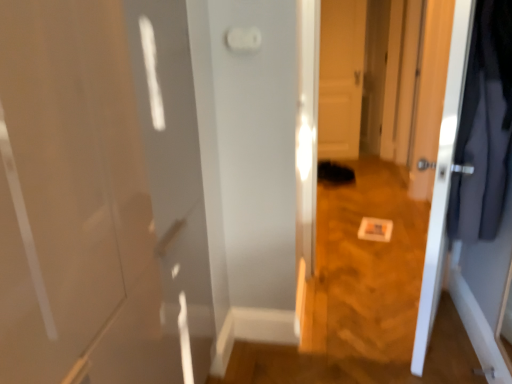
What is the approximate height of white glossy door at center, acting as the first door starting from the back?

It is 1.61 meters.

Describe the element at coordinates (243, 39) in the screenshot. I see `white plastic light switch at upper center` at that location.

Describe the element at coordinates (484, 126) in the screenshot. Image resolution: width=512 pixels, height=384 pixels. I see `dark gray fabric coat at right` at that location.

How much space does white glossy door at right, which appears as the 1th door when viewed from the front, occupy vertically?

The height of white glossy door at right, which appears as the 1th door when viewed from the front, is 4.84 feet.

At what (x,y) coordinates should I click in order to perform the action: click on white glossy door at right, which appears as the 1th door when viewed from the front. Please return your answer as a coordinate pair (x, y). Looking at the image, I should click on (474, 187).

This screenshot has height=384, width=512. I want to click on white glossy door at center, acting as the first door starting from the back, so click(x=340, y=78).

Does dark gray fabric coat at right come behind white glossy door at right, which appears as the 1th door when viewed from the front?

No, it is in front of white glossy door at right, which appears as the 1th door when viewed from the front.

From a real-world perspective, is dark gray fabric coat at right on top of white glossy door at right, which is the second door in back-to-front order?

Indeed, from a real-world perspective, dark gray fabric coat at right stands above white glossy door at right, which is the second door in back-to-front order.

Which object is positioned more to the left, dark gray fabric coat at right or white glossy door at right, which appears as the 1th door when viewed from the front?

white glossy door at right, which appears as the 1th door when viewed from the front.

Based on the photo, based on their sizes in the image, would you say dark gray fabric coat at right is bigger or smaller than white glossy door at right, which appears as the 1th door when viewed from the front?

Considering their sizes, dark gray fabric coat at right takes up less space than white glossy door at right, which appears as the 1th door when viewed from the front.

Considering the positions of points (345, 88) and (496, 312), is point (345, 88) farther from camera compared to point (496, 312)?

Yes, it is.

How many degrees apart are the facing directions of white glossy door at center, acting as the first door starting from the back, and white glossy door at right, which is the second door in back-to-front order?

124 degrees.

Would you say white glossy door at center, which appears as the 2th door when viewed from the front, is to the left or to the right of white glossy door at right, which is the second door in back-to-front order, in the picture?

Clearly, white glossy door at center, which appears as the 2th door when viewed from the front, is on the right of white glossy door at right, which is the second door in back-to-front order, in the image.

How distant is white glossy door at center, acting as the first door starting from the back, from white glossy door at right, which appears as the 1th door when viewed from the front?

white glossy door at center, acting as the first door starting from the back, and white glossy door at right, which appears as the 1th door when viewed from the front, are 2.76 meters apart from each other.

Considering the points (258, 33) and (484, 32), which point is behind, point (258, 33) or point (484, 32)?

The point (258, 33) is behind.

Visually, is white plastic light switch at upper center positioned to the left or to the right of white glossy door at right, which appears as the 1th door when viewed from the front?

Based on their positions, white plastic light switch at upper center is located to the left of white glossy door at right, which appears as the 1th door when viewed from the front.

Can you confirm if white plastic light switch at upper center is thinner than white glossy door at right, which is the second door in back-to-front order?

Yes, white plastic light switch at upper center is thinner than white glossy door at right, which is the second door in back-to-front order.

Is white plastic light switch at upper center not within white glossy door at right, which is the second door in back-to-front order?

Absolutely, white plastic light switch at upper center is external to white glossy door at right, which is the second door in back-to-front order.

Does white plastic light switch at upper center have a lesser height compared to dark gray fabric coat at right?

Yes, white plastic light switch at upper center is shorter than dark gray fabric coat at right.

In the scene shown: Does white plastic light switch at upper center have a lesser width compared to dark gray fabric coat at right?

Yes.

Is white plastic light switch at upper center not close to dark gray fabric coat at right?

white plastic light switch at upper center is actually quite close to dark gray fabric coat at right.

Does white glossy door at center, acting as the first door starting from the back, lie behind white plastic light switch at upper center?

Yes.

Is white glossy door at center, which appears as the 2th door when viewed from the front, outside of white plastic light switch at upper center?

Absolutely, white glossy door at center, which appears as the 2th door when viewed from the front, is external to white plastic light switch at upper center.

From the image's perspective, would you say white glossy door at center, which appears as the 2th door when viewed from the front, is positioned over white plastic light switch at upper center?

Yes, from the image's perspective, white glossy door at center, which appears as the 2th door when viewed from the front, is on top of white plastic light switch at upper center.

Are white glossy door at center, acting as the first door starting from the back, and white plastic light switch at upper center located far from each other?

Yes, white glossy door at center, acting as the first door starting from the back, is far from white plastic light switch at upper center.

From the image's perspective, which is above, dark gray fabric coat at right or white plastic light switch at upper center?

white plastic light switch at upper center.

Which object is positioned more to the left, dark gray fabric coat at right or white plastic light switch at upper center?

white plastic light switch at upper center is more to the left.

Is the depth of dark gray fabric coat at right less than that of white plastic light switch at upper center?

Yes, dark gray fabric coat at right is closer to the camera.

Is white plastic light switch at upper center directly adjacent to white glossy door at center, which appears as the 2th door when viewed from the front?

No, white plastic light switch at upper center is not next to white glossy door at center, which appears as the 2th door when viewed from the front.

Considering the relative sizes of white plastic light switch at upper center and white glossy door at center, acting as the first door starting from the back, in the image provided, is white plastic light switch at upper center taller than white glossy door at center, acting as the first door starting from the back,?

No.

Locate an element on the screen. The height and width of the screenshot is (384, 512). light switch located in front of the white glossy door at center, acting as the first door starting from the back is located at coordinates (243, 39).

This screenshot has height=384, width=512. I want to click on the 2nd door positioned below the dark gray fabric coat at right (from a real-world perspective), so click(474, 187).

The height and width of the screenshot is (384, 512). Find the location of `door above the white glossy door at right, which appears as the 1th door when viewed from the front (from the image's perspective)`. door above the white glossy door at right, which appears as the 1th door when viewed from the front (from the image's perspective) is located at coordinates (340, 78).

Based on their spatial positions, is dark gray fabric coat at right or white glossy door at right, which is the second door in back-to-front order, further from white plastic light switch at upper center?

white glossy door at right, which is the second door in back-to-front order, lies further to white plastic light switch at upper center than the other object.

Based on their spatial positions, is dark gray fabric coat at right or white glossy door at center, acting as the first door starting from the back, closer to white plastic light switch at upper center?

The object closer to white plastic light switch at upper center is dark gray fabric coat at right.

From the image, which object appears to be farther from white glossy door at right, which appears as the 1th door when viewed from the front, dark gray fabric coat at right or white plastic light switch at upper center?

white plastic light switch at upper center.

When comparing their distances from white glossy door at center, which appears as the 2th door when viewed from the front, does dark gray fabric coat at right or white glossy door at right, which is the second door in back-to-front order, seem closer?

Among the two, white glossy door at right, which is the second door in back-to-front order, is located nearer to white glossy door at center, which appears as the 2th door when viewed from the front.

Estimate the real-world distances between objects in this image. Which object is further from white plastic light switch at upper center, white glossy door at right, which appears as the 1th door when viewed from the front, or white glossy door at center, which appears as the 2th door when viewed from the front?

white glossy door at center, which appears as the 2th door when viewed from the front, is positioned further to the anchor white plastic light switch at upper center.

When comparing their distances from white glossy door at center, which appears as the 2th door when viewed from the front, does white glossy door at right, which is the second door in back-to-front order, or dark gray fabric coat at right seem further?

dark gray fabric coat at right is further to white glossy door at center, which appears as the 2th door when viewed from the front.

Looking at the image, which one is located further to dark gray fabric coat at right, white plastic light switch at upper center or white glossy door at right, which is the second door in back-to-front order?

white plastic light switch at upper center is further to dark gray fabric coat at right.

Considering their positions, is white plastic light switch at upper center positioned closer to white glossy door at right, which appears as the 1th door when viewed from the front, than dark gray fabric coat at right?

dark gray fabric coat at right is positioned closer to the anchor white glossy door at right, which appears as the 1th door when viewed from the front.

What are the coordinates of `door situated between white plastic light switch at upper center and dark gray fabric coat at right from left to right` in the screenshot? It's located at (474, 187).

Where is `door located between dark gray fabric coat at right and white glossy door at center, which appears as the 2th door when viewed from the front, in the depth direction`? This screenshot has height=384, width=512. door located between dark gray fabric coat at right and white glossy door at center, which appears as the 2th door when viewed from the front, in the depth direction is located at coordinates (474, 187).

The height and width of the screenshot is (384, 512). Find the location of `light switch positioned between white glossy door at right, which is the second door in back-to-front order, and white glossy door at center, which appears as the 2th door when viewed from the front, from near to far`. light switch positioned between white glossy door at right, which is the second door in back-to-front order, and white glossy door at center, which appears as the 2th door when viewed from the front, from near to far is located at coordinates (243, 39).

Find the location of `light switch located between dark gray fabric coat at right and white glossy door at center, which appears as the 2th door when viewed from the front, in the depth direction`. light switch located between dark gray fabric coat at right and white glossy door at center, which appears as the 2th door when viewed from the front, in the depth direction is located at coordinates (243, 39).